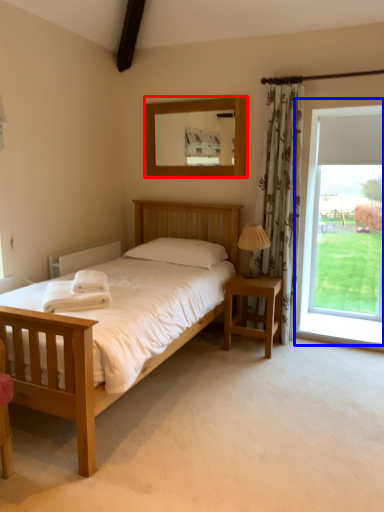
Question: Which object is further to the camera taking this photo, mirror (highlighted by a red box) or window (highlighted by a blue box)?

Choices:
 (A) mirror
 (B) window

Answer: (B)